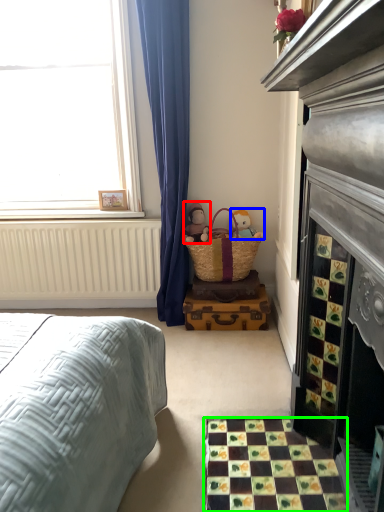
Question: Estimate the real-world distances between objects in this image. Which object is closer to doll (highlighted by a red box), toy (highlighted by a blue box) or tile (highlighted by a green box)?

Choices:
 (A) toy
 (B) tile

Answer: (A)